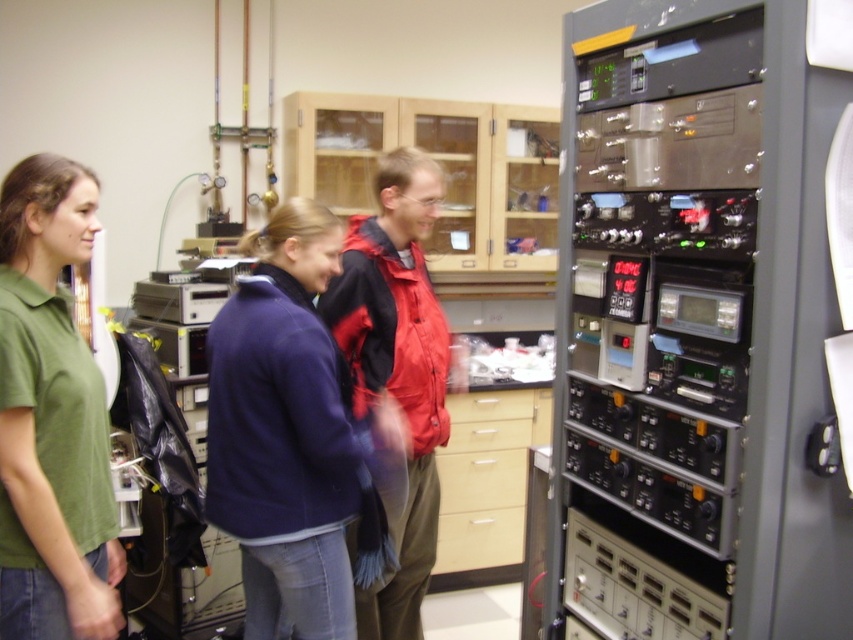
Is green cotton shirt at left to the right of red matte jacket at center from the viewer's perspective?

No, green cotton shirt at left is not to the right of red matte jacket at center.

Does green cotton shirt at left have a larger size compared to red matte jacket at center?

No, green cotton shirt at left is not bigger than red matte jacket at center.

Who is more forward, (102,406) or (386,288)?

Point (102,406) is in front.

The width and height of the screenshot is (853, 640). In order to click on green cotton shirt at left in this screenshot , I will do `click(51, 419)`.

Which of these two, navy blue fabric coat at center or red matte jacket at center, stands shorter?

With less height is navy blue fabric coat at center.

Which is behind, point (322, 490) or point (346, 259)?

Point (346, 259)

Is point (260, 467) positioned in front of point (395, 225)?

Yes, it is.

You are a GUI agent. You are given a task and a screenshot of the screen. Output one action in this format:
    pyautogui.click(x=<x>, y=<y>)
    Task: Click on the navy blue fabric coat at center
    Image resolution: width=853 pixels, height=640 pixels.
    Given the screenshot: What is the action you would take?
    pyautogui.click(x=286, y=435)

Is navy blue fabric coat at center shorter than green cotton shirt at left?

No.

Who is more forward, (241, 371) or (18, 285)?

Point (18, 285)

Find the location of `navy blue fabric coat at center`. navy blue fabric coat at center is located at coordinates (286, 435).